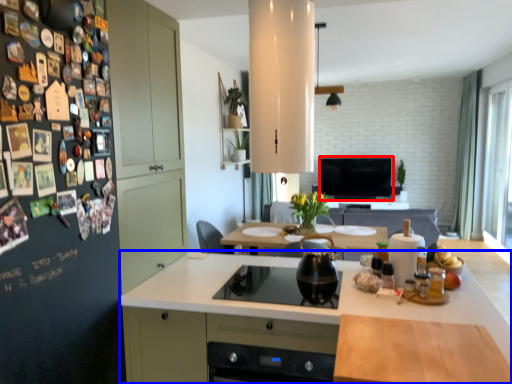
Question: Which of the following is the closest to the observer, television (highlighted by a red box) or countertop (highlighted by a blue box)?

Choices:
 (A) television
 (B) countertop

Answer: (B)